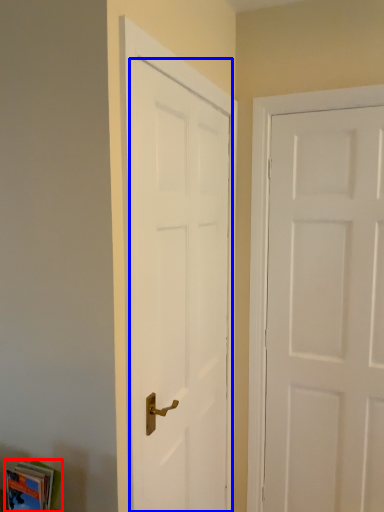
Question: Which object appears farthest to the camera in this image, book (highlighted by a red box) or door (highlighted by a blue box)?

Choices:
 (A) book
 (B) door

Answer: (B)